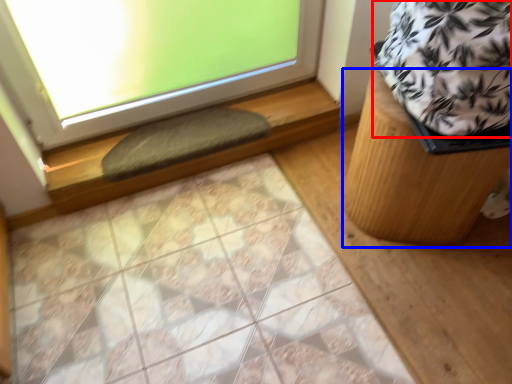
Question: Which object is closer to the camera taking this photo, blanket (highlighted by a red box) or furniture (highlighted by a blue box)?

Choices:
 (A) blanket
 (B) furniture

Answer: (A)